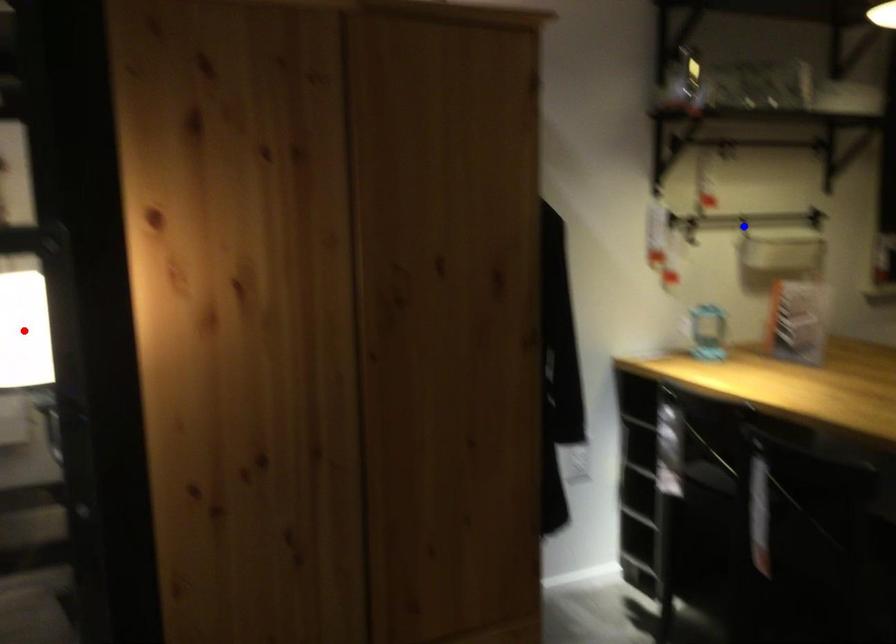
Question: In the image, two points are highlighted. Which point is nearer to the camera? Reply with the corresponding letter.

Choices:
 (A) blue point
 (B) red point

Answer: (B)